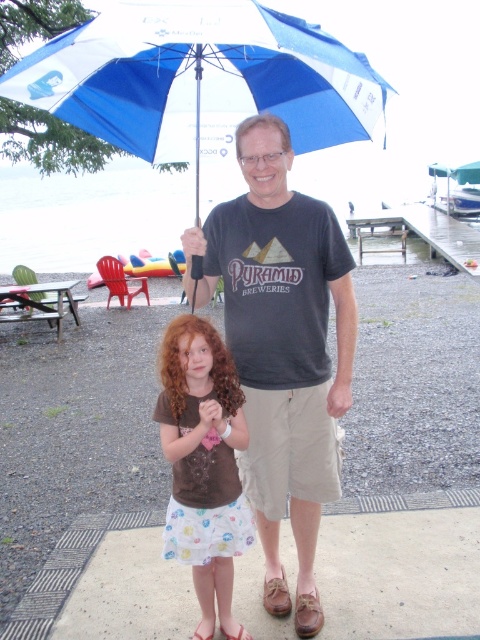
Question: Which of the following is the farthest from the observer?

Choices:
 (A) (168, 401)
 (B) (220, 208)

Answer: (B)

Question: Which point is closer to the camera?

Choices:
 (A) (76, 566)
 (B) (19, 296)

Answer: (A)

Question: Can you confirm if concrete at center is thinner than blue/white striped umbrella at upper center?

Choices:
 (A) yes
 (B) no

Answer: (B)

Question: Does blue/white striped umbrella at upper center appear under concrete pavement at lower center?

Choices:
 (A) yes
 (B) no

Answer: (B)

Question: Can you confirm if blue/white striped umbrella at upper center is positioned to the left of wooden picnic table at left?

Choices:
 (A) no
 (B) yes

Answer: (A)

Question: Which of the following is the farthest from the observer?

Choices:
 (A) (245, 330)
 (B) (46, 301)

Answer: (B)